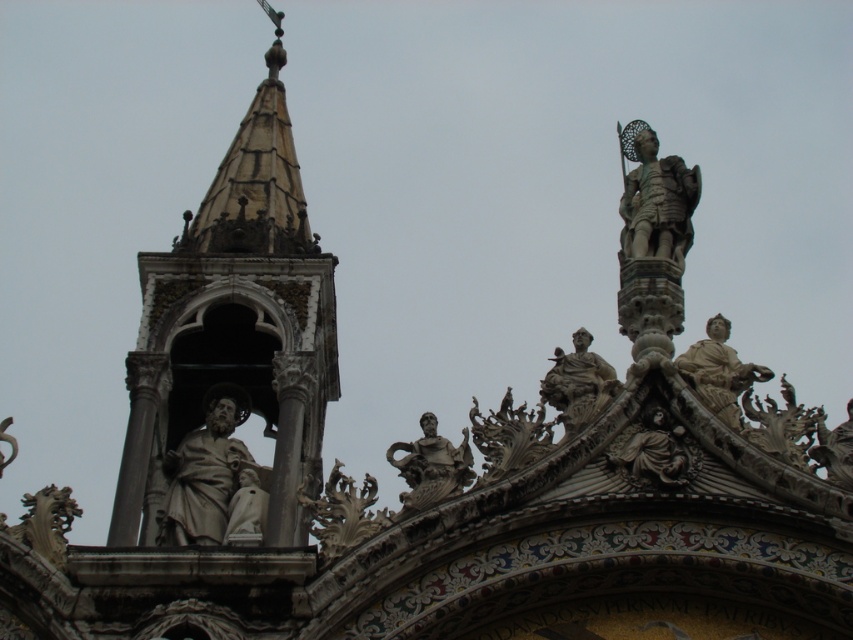
Measure the distance between stone statue at left and camera.

stone statue at left is 230.56 feet from camera.

Does stone statue at left lie behind polished stone statue at center?

Yes, stone statue at left is further from the viewer.

Is point (260, 532) farther from viewer compared to point (325, 522)?

Yes, point (260, 532) is farther from viewer.

In order to click on stone statue at left in this screenshot , I will do click(x=231, y=352).

Can you confirm if white marble statue at upper right is smaller than polished stone statue at center?

Actually, white marble statue at upper right might be larger than polished stone statue at center.

You are a GUI agent. You are given a task and a screenshot of the screen. Output one action in this format:
    pyautogui.click(x=<x>, y=<y>)
    Task: Click on the white marble statue at upper right
    This screenshot has width=853, height=640.
    Given the screenshot: What is the action you would take?
    pyautogui.click(x=718, y=372)

Describe the element at coordinates (718, 372) in the screenshot. I see `white marble statue at upper right` at that location.

I want to click on white marble statue at upper right, so click(x=718, y=372).

Does beige stone statue at center-left lie in front of polished stone statue at center?

No, it is behind polished stone statue at center.

Describe the element at coordinates (210, 474) in the screenshot. I see `beige stone statue at center-left` at that location.

Describe the element at coordinates (210, 474) in the screenshot. I see `beige stone statue at center-left` at that location.

At what (x,y) coordinates should I click in order to perform the action: click on beige stone statue at center-left. Please return your answer as a coordinate pair (x, y). Looking at the image, I should click on (210, 474).